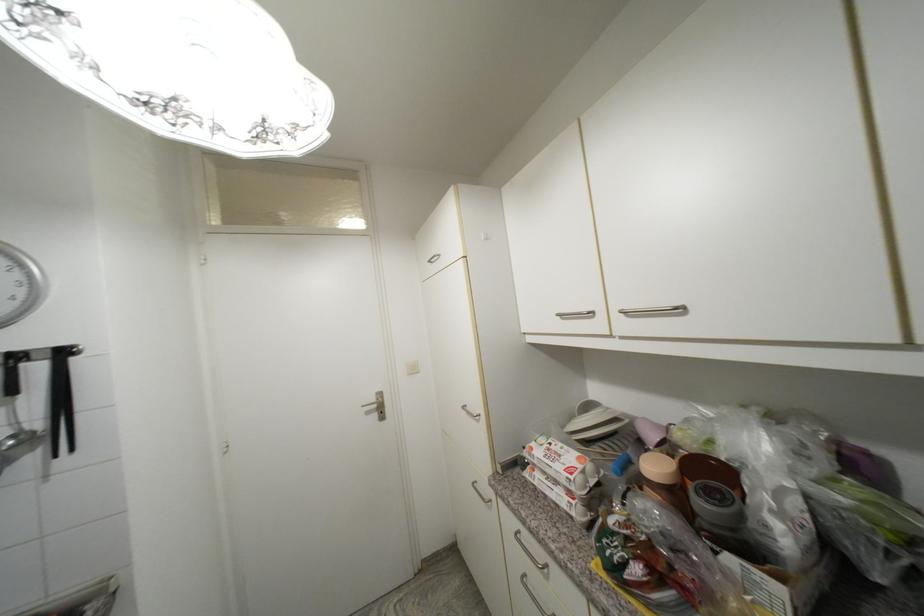
Where would you lift the plastic grocery bag? Please return your answer as a coordinate pair (x, y).

(774, 480)